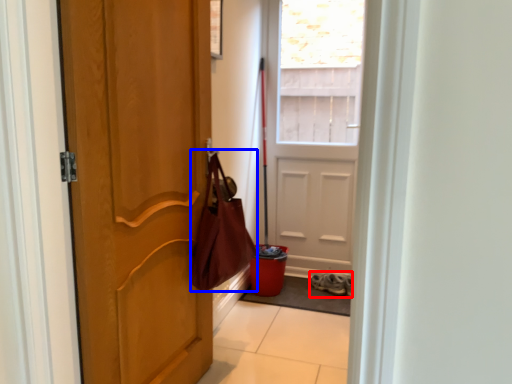
Question: Which object appears farthest to the camera in this image, footwear (highlighted by a red box) or shoulder bag (highlighted by a blue box)?

Choices:
 (A) footwear
 (B) shoulder bag

Answer: (A)